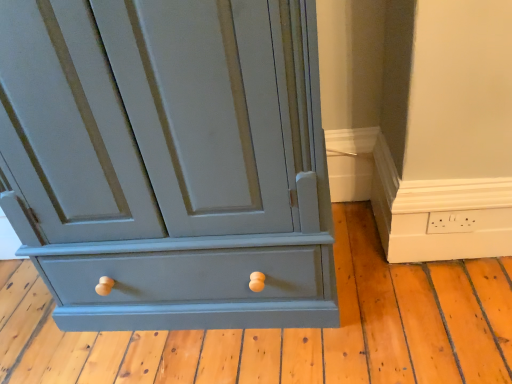
Locate an element on the screen. The image size is (512, 384). matte gray cabinet at center is located at coordinates (169, 161).

Describe the element at coordinates (169, 161) in the screenshot. Image resolution: width=512 pixels, height=384 pixels. I see `matte gray cabinet at center` at that location.

Find the location of a particular element. Image resolution: width=512 pixels, height=384 pixels. matte gray cabinet at center is located at coordinates (169, 161).